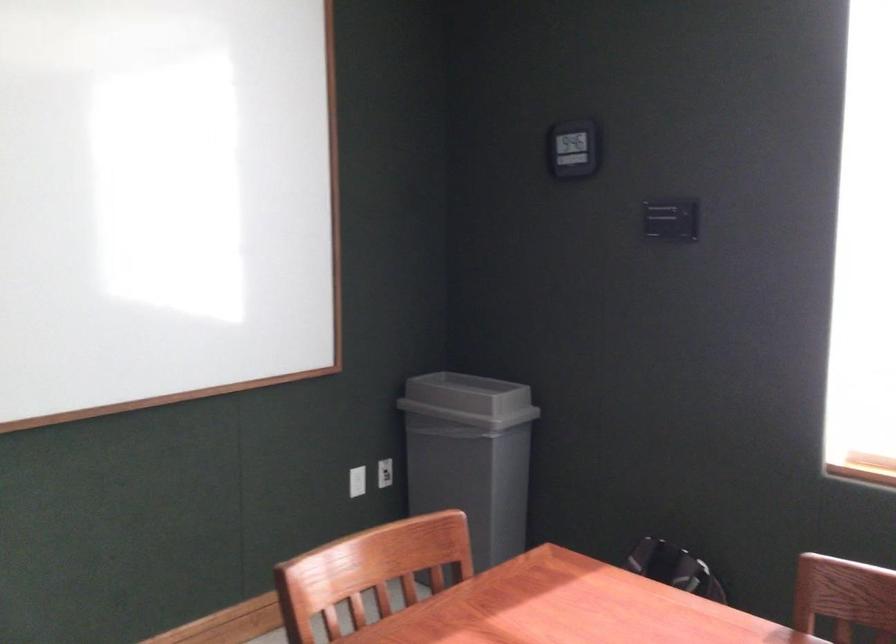
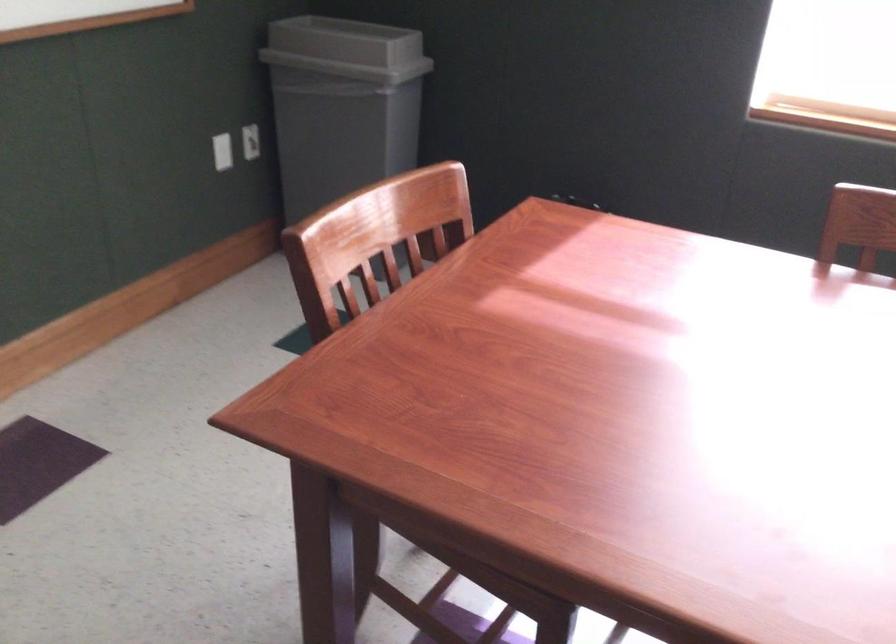
The first image is from the beginning of the video and the second image is from the end. How did the camera likely rotate when shooting the video?

The rotation direction of the camera is right-down.